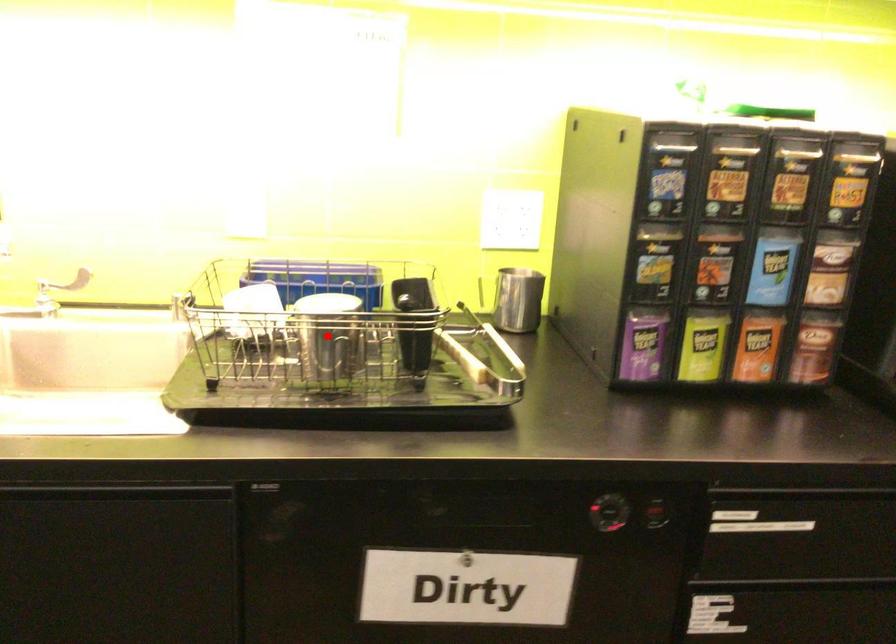
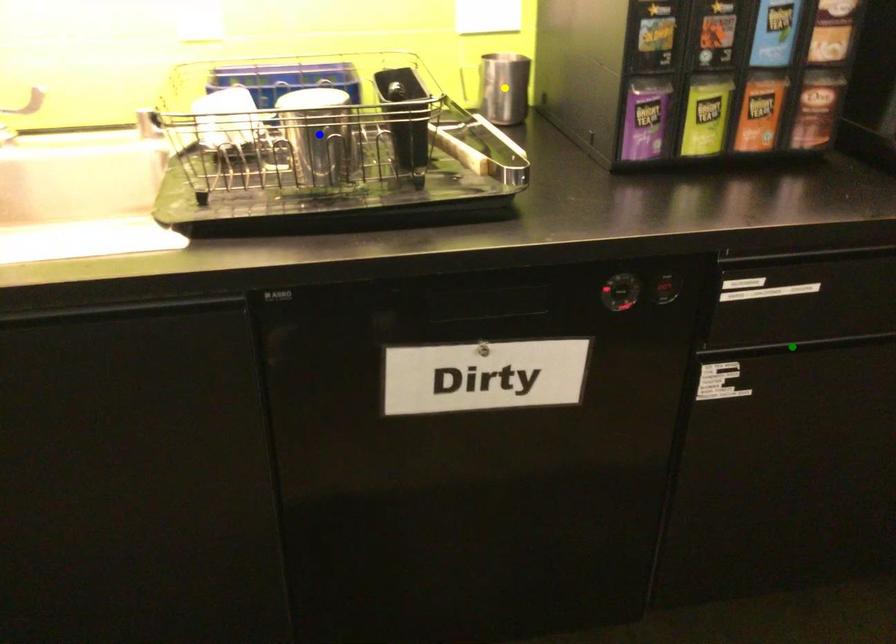
Question: I am providing you with two images of the same scene from different viewpoints. A red point is marked on the first image. You are given multiple points on the second image. Which spot in image 2 lines up with the point in image 1?

Choices:
 (A) yellow point
 (B) green point
 (C) blue point

Answer: (C)